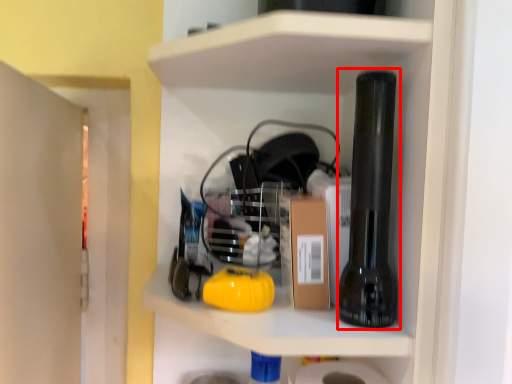
Question: From the image's perspective, considering the relative positions of beer bottle (annotated by the red box) and cardboard box in the image provided, where is beer bottle (annotated by the red box) located with respect to the staircase?

Choices:
 (A) below
 (B) above

Answer: (B)